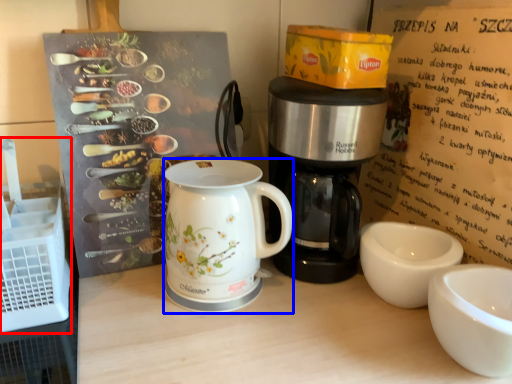
Question: Among these objects, which one is nearest to the camera, crate (highlighted by a red box) or jug (highlighted by a blue box)?

Choices:
 (A) crate
 (B) jug

Answer: (A)